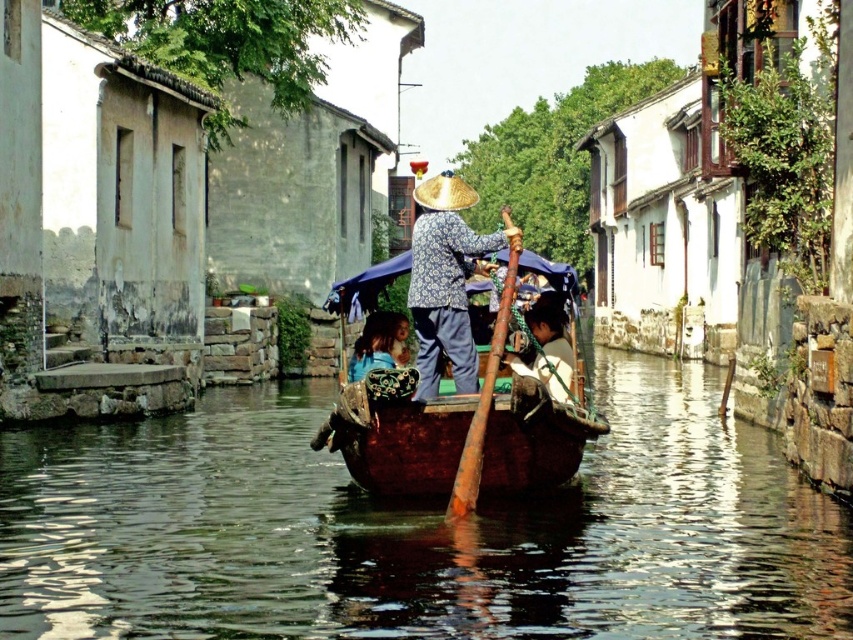
Question: Which of the following is the closest to the observer?

Choices:
 (A) dark brown polished wood canoe at center
 (B) matte brown hat at center
 (C) rusty wooden paddle at center
 (D) brown wooden boat at center

Answer: (D)

Question: Which of the following is the farthest from the observer?

Choices:
 (A) (560, 477)
 (B) (523, 436)
 (C) (558, 348)
 (D) (241, 467)

Answer: (D)

Question: Is the position of brown wooden boat at center less distant than that of wooden boat at center?

Choices:
 (A) no
 (B) yes

Answer: (B)

Question: Is rusty wooden paddle at center above golden straw hat at center?

Choices:
 (A) yes
 (B) no

Answer: (B)

Question: Where is brown wooden boat at center located in relation to dark brown polished wood canoe at center in the image?

Choices:
 (A) right
 (B) left

Answer: (B)

Question: Which point is farther from the camera taking this photo?

Choices:
 (A) (531, 419)
 (B) (593, 372)

Answer: (B)